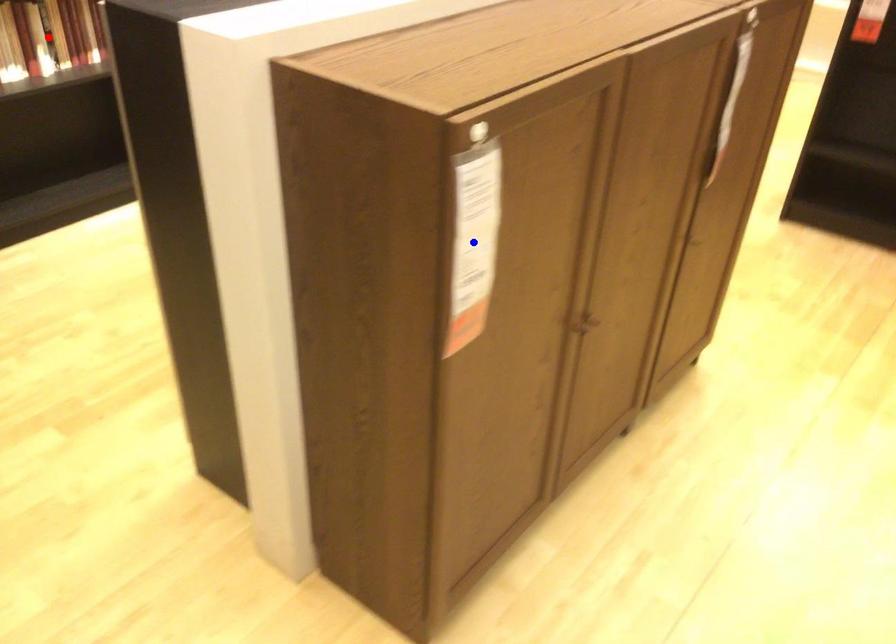
Question: In the image, two points are highlighted. Which point is nearer to the camera? Reply with the corresponding letter.

Choices:
 (A) blue point
 (B) red point

Answer: (A)